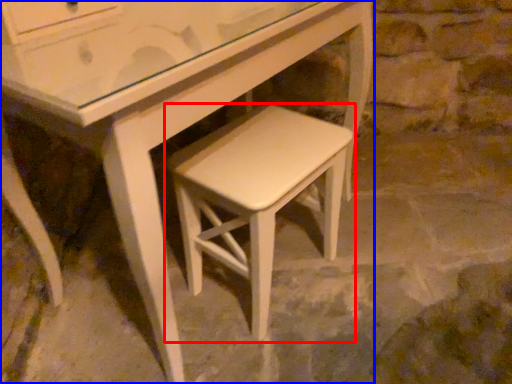
Question: Which of the following is the closest to the observer, stool (highlighted by a red box) or table (highlighted by a blue box)?

Choices:
 (A) stool
 (B) table

Answer: (A)